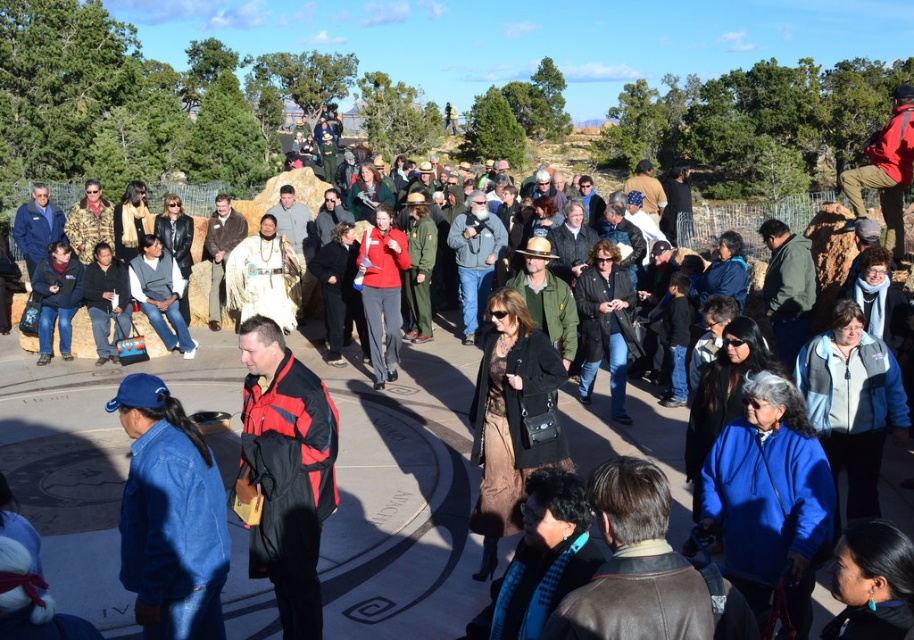
You are a photographer trying to capture a photo of the historical monument. You notice two people wearing jackets in the scene. The denim jacket at lower left and the matte red jacket at center are blocking your view. Which jacket is smaller and can be easily moved out of the frame without disturbing the other person?

The denim jacket at lower left is smaller compared to the matte red jacket at center, so it can be easily moved out of the frame without disturbing the other person.

You are taking a photo of the historical monument and want to ensure both the point at coordinates point (284, 509) and the point at coordinates point (384, 307) are in focus. Which point should you focus on first to ensure both are sharp in the final image?

You should focus on point (284, 509) first because it is closer to the camera, ensuring that both points will be in focus when using proper depth of field settings.

You are standing at the center of the monument and want to find the denim jacket at lower left. According to the coordinates provided, in which direction should you move to locate it?

The denim jacket at lower left is located at coordinates point (169, 516). Since the coordinate system typically has the origin at the top left corner of the image, the lower left position would mean moving downward and to the left from the monument. However, given the x coordinate 0.808 is closer to the right edge, but the y coordinate 0.187 is lower down. Wait, there might be confusion here. Let me think again. In standard image coordinate systems, the origin is at the top left, so x increases to the 2